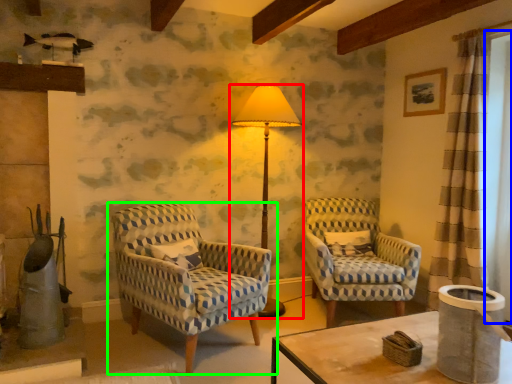
Question: Which object is positioned farthest from lamp (highlighted by a red box)? Select from window screen (highlighted by a blue box) and chair (highlighted by a green box).

Choices:
 (A) window screen
 (B) chair

Answer: (A)